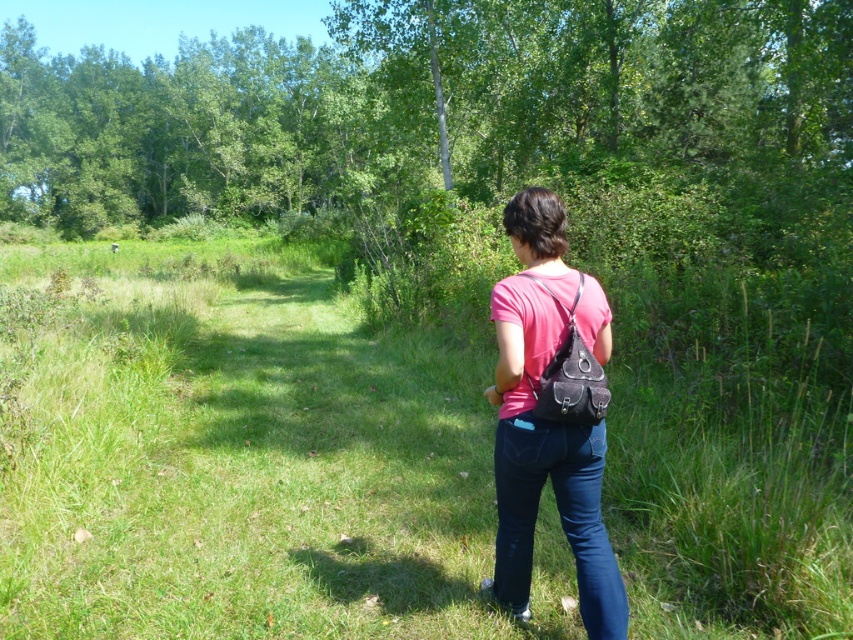
Question: Based on their relative distances, which object is farther from the green grassy at center?

Choices:
 (A) denim at center
 (B) pink fabric shirt at center

Answer: (B)

Question: Can you confirm if pink fabric shirt at center is wider than denim at center?

Choices:
 (A) yes
 (B) no

Answer: (A)

Question: Estimate the real-world distances between objects in this image. Which object is farther from the denim at center?

Choices:
 (A) pink fabric shirt at center
 (B) green grassy at center

Answer: (B)

Question: Is green grassy at center smaller than denim at center?

Choices:
 (A) no
 (B) yes

Answer: (A)

Question: Is green grassy at center smaller than denim at center?

Choices:
 (A) yes
 (B) no

Answer: (B)

Question: Based on their relative distances, which object is farther from the green grassy at center?

Choices:
 (A) denim at center
 (B) pink fabric shirt at center

Answer: (B)